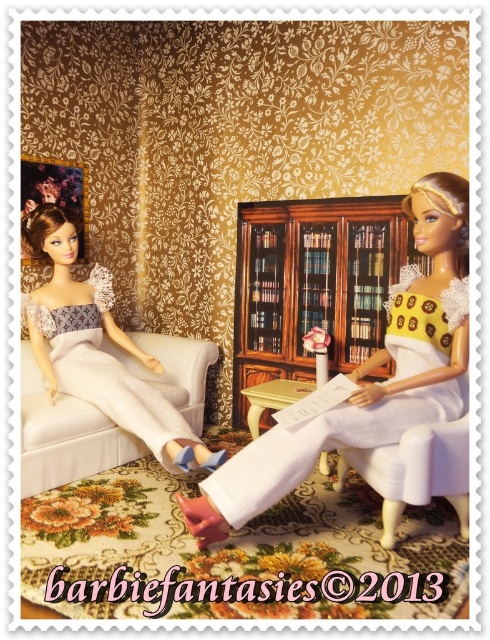
You are a fashion designer observing the two dolls in the vintage room. You need to determine which doll is wearing the longer dress. The dolls are wearing a yellow matte dress at center and a white satin dress at left. Based on the scene, which dress is longer?

The yellow matte dress at center is taller than the white satin dress at left, so the yellow matte dress at center is the longer one.

You are a photographer trying to capture a clear photo of both dolls in the vintage room. You notice two points marked in the scene. The first point is at coordinate point [427,177] and the second point is at coordinate point [135,376]. Which point is closer to the camera lens?

Point [427,177] is in front of point [135,376], so the first point is closer to the camera lens.